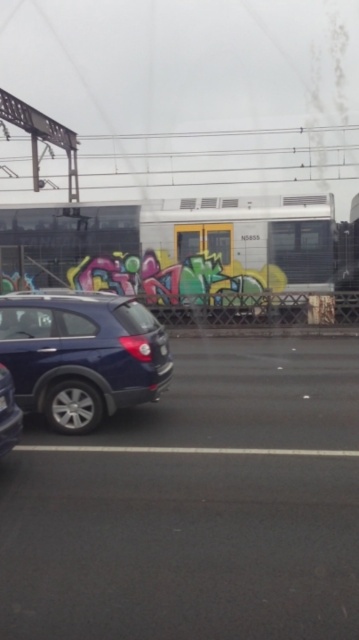
From the picture: You are a driver approaching the intersection and see the satin black car at left and the black plastic license plate at lower left. Which object is bigger?

The satin black car at left is larger in size than the black plastic license plate at lower left.

You are standing at the point marked by the coordinate point at (81,355). What object is located at that point?

The point at (81,355) corresponds to the satin blue suv at left.

You are a delivery person who needs to load a tall package into a vehicle. You see the satin blue suv at left and the satin black car at left. Which vehicle can accommodate the tall package better?

The satin blue suv at left has a greater height compared to the satin black car at left, so it can accommodate the tall package better.